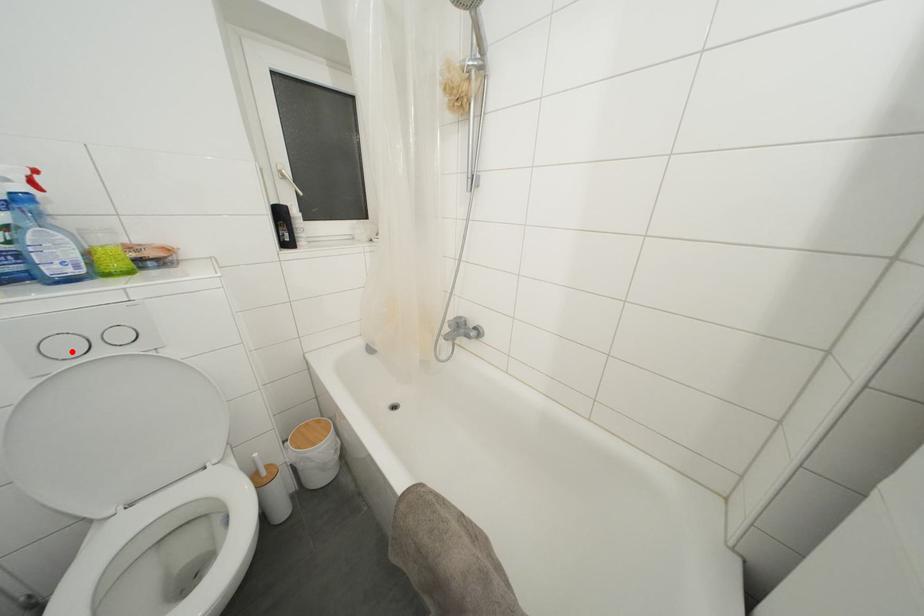
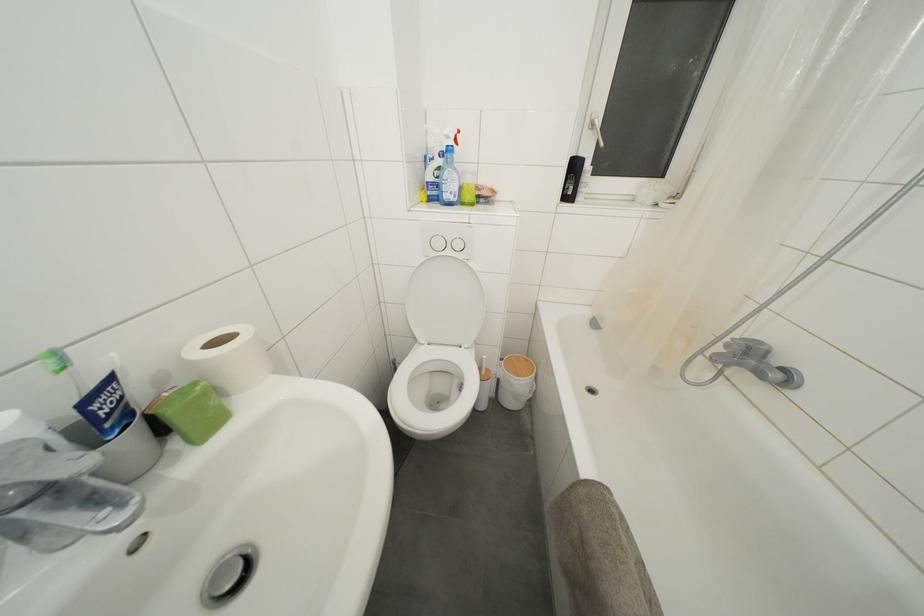
In the second image, find the point that corresponds to the highlighted location in the first image.

(443, 249)